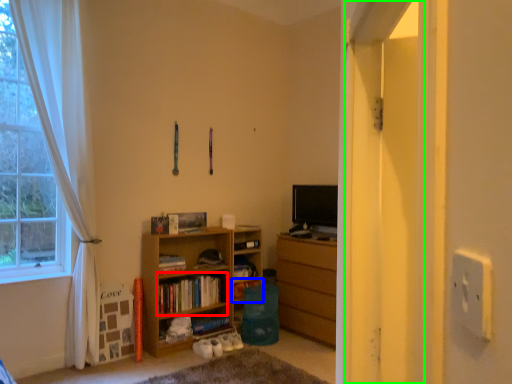
Question: Estimate the real-world distances between objects in this image. Which object is closer to book (highlighted by a red box), shelf (highlighted by a blue box) or screen door (highlighted by a green box)?

Choices:
 (A) shelf
 (B) screen door

Answer: (A)